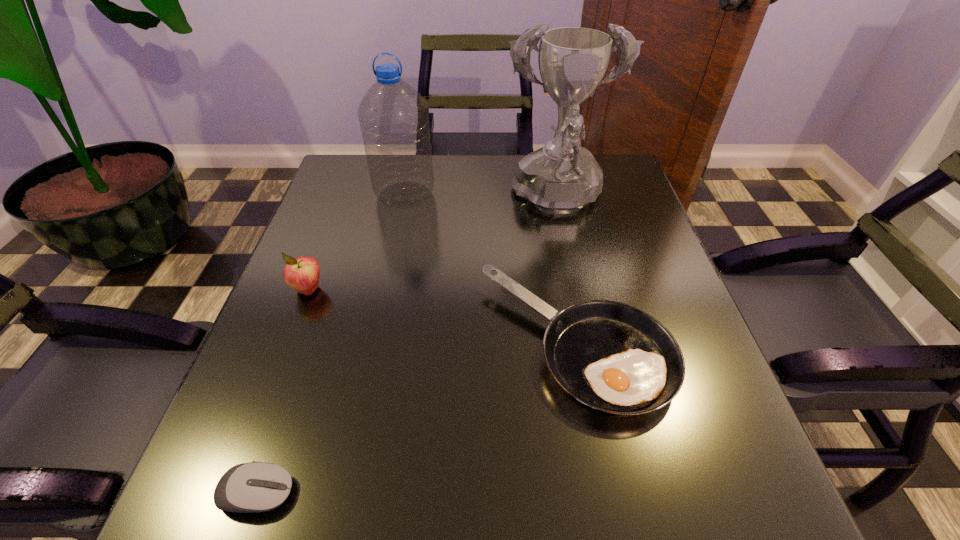
This screenshot has height=540, width=960. I want to click on free spot between the frying pan and the computer equipment, so click(416, 418).

What are the coordinates of `vacant space in between the frying pan and the award` in the screenshot? It's located at (566, 273).

I want to click on vacant area between the nearest object and the apple, so click(282, 392).

At what (x,y) coordinates should I click in order to perform the action: click on empty location between the apple and the computer equipment. Please return your answer as a coordinate pair (x, y). Image resolution: width=960 pixels, height=540 pixels. Looking at the image, I should click on (282, 392).

Where is `free space between the second shortest object and the third shortest object`? The width and height of the screenshot is (960, 540). free space between the second shortest object and the third shortest object is located at coordinates (442, 317).

At what (x,y) coordinates should I click in order to perform the action: click on empty location between the second tallest object and the apple. Please return your answer as a coordinate pair (x, y). The image size is (960, 540). Looking at the image, I should click on (356, 242).

Locate an element on the screen. The width and height of the screenshot is (960, 540). free area in between the award and the fourth tallest object is located at coordinates (566, 273).

This screenshot has width=960, height=540. Find the location of `the third closest object to the third tallest object`. the third closest object to the third tallest object is located at coordinates (253, 487).

Select which object appears as the closest to the third tallest object. Please provide its 2D coordinates. Your answer should be formatted as a tuple, i.e. [(x, y)], where the tuple contains the x and y coordinates of a point satisfying the conditions above.

[(394, 120)]

Locate an element on the screen. The image size is (960, 540). free space that satisfies the following two spatial constraints: 1. on the side with emblem of the award; 2. on the wheel side of the computer equipment is located at coordinates (618, 493).